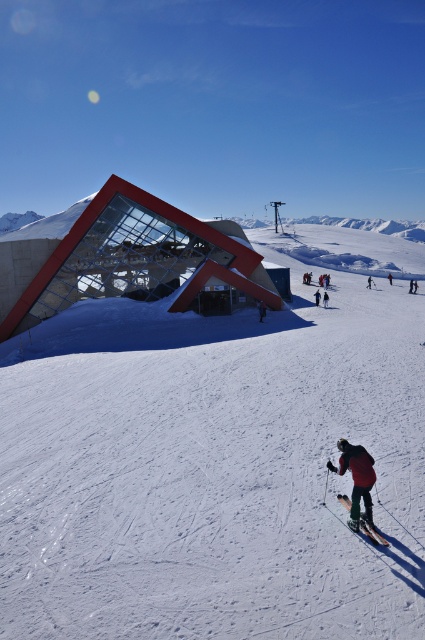
You are a drone operator trying to capture the red fabric jacket at lower center in the center of your camera frame. The camera has a field of view that covers a 0.2x0.2 area. What is the minimum horizontal and vertical adjustment needed to center the jacket?

The red fabric jacket at lower center is located at coordinates [357,480]. To center it within a 0.2x0.2 frame, the camera needs to adjust horizontally to 0.750 and vertically to 0.840. Since the frame is centered at these coordinates, no adjustment is needed beyond positioning the center at those coordinates.

You are a photographer standing at the base of the slope. You want to take a photo of the black fabric jacket at lower center and the red ski suit at center so that both are clearly visible in the frame. Given that your camera has a maximum focal length that allows capturing objects up to 25 meters apart, will you be able to include both in the same photo?

The black fabric jacket at lower center is 24.93 meters from the red ski suit at center. Since the distance between them is less than 25 meters, your camera can capture both in the same photo.